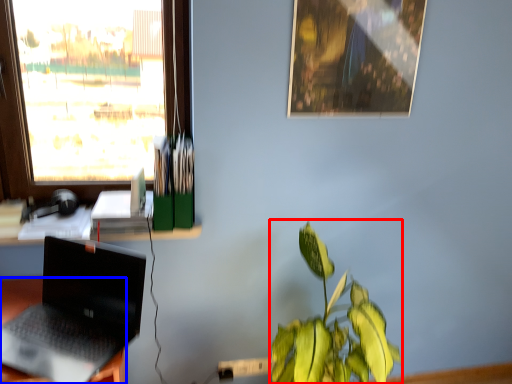
Question: Which object is closer to the camera taking this photo, houseplant (highlighted by a red box) or desk (highlighted by a blue box)?

Choices:
 (A) houseplant
 (B) desk

Answer: (A)